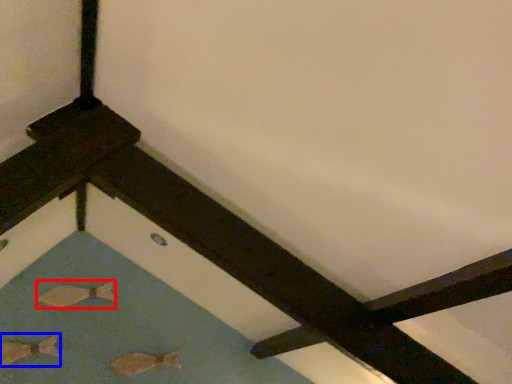
Question: Which point is closer to the camera, fish (highlighted by a red box) or fish (highlighted by a blue box)?

Choices:
 (A) fish
 (B) fish

Answer: (B)